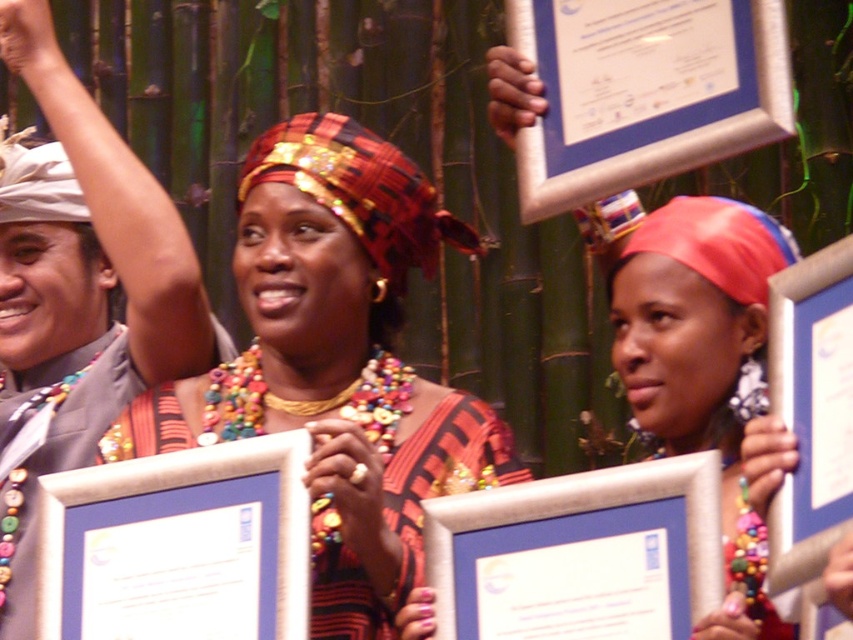
Who is more distant from viewer, [73,554] or [642,461]?

The point [73,554] is behind.

In the scene shown: Can you confirm if matte silver picture frame at center is positioned below silver metallic picture frame at center?

Yes.

Find the location of a particular element. This screenshot has width=853, height=640. matte silver picture frame at center is located at coordinates (178, 545).

Which is behind, point (347, 360) or point (434, 589)?

Point (347, 360)

Is matte fabric headscarf at center to the left of silver metallic picture frame at center from the viewer's perspective?

Indeed, matte fabric headscarf at center is positioned on the left side of silver metallic picture frame at center.

Does point (320, 388) come in front of point (573, 513)?

No, (320, 388) is behind (573, 513).

Identify the location of matte fabric headscarf at center. (335, 364).

Which of these two, matte fabric headscarf at center or matte silver picture frame at center, stands shorter?

matte silver picture frame at center is shorter.

Is matte fabric headscarf at center wider than matte silver picture frame at center?

Yes.

At what (x,y) coordinates should I click in order to perform the action: click on matte fabric headscarf at center. Please return your answer as a coordinate pair (x, y). Image resolution: width=853 pixels, height=640 pixels. Looking at the image, I should click on (335, 364).